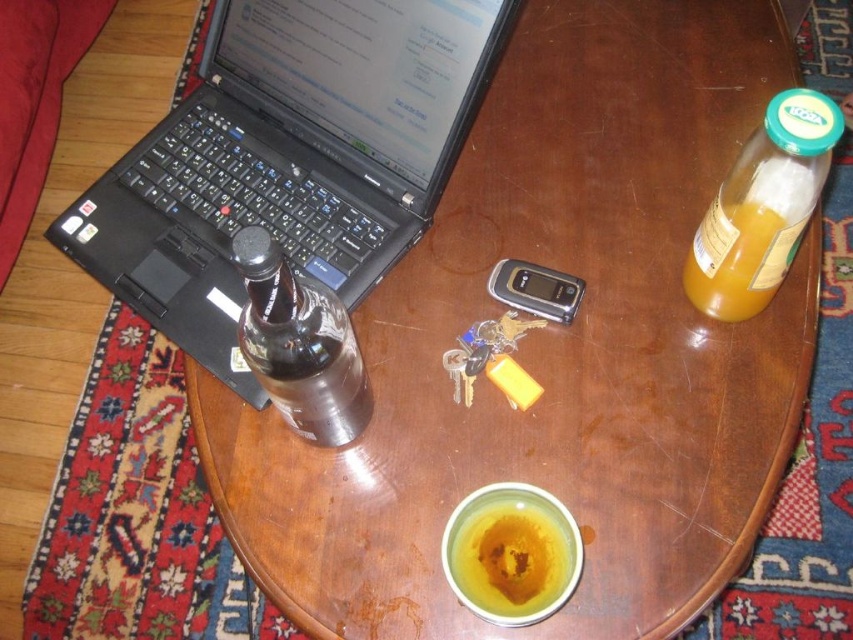
You are organizing items on the wooden coffee table and need to place both the translucent plastic bottle at upper right and the yellow matte cup at center. Considering their sizes, which item should you place first to ensure they both fit on the table?

The translucent plastic bottle at upper right is wider than the yellow matte cup at center. Therefore, you should place the translucent plastic bottle at upper right first to accommodate its larger width, ensuring there is enough space left for the yellow matte cup at center.

You are organizing items on a wooden coffee table. You have a black plastic laptop at left and a transparent glass bottle at left. Which item is taller?

The black plastic laptop at left is much taller than the transparent glass bottle at left.

You are organizing items on a wooden coffee table. You have a black plastic laptop at left and a transparent glass bottle at left. If you want to place a new item between them, which item should you move to make space?

You should move the transparent glass bottle at left because the black plastic laptop at left is wider, so moving the smaller transparent glass bottle at left would create space between them.